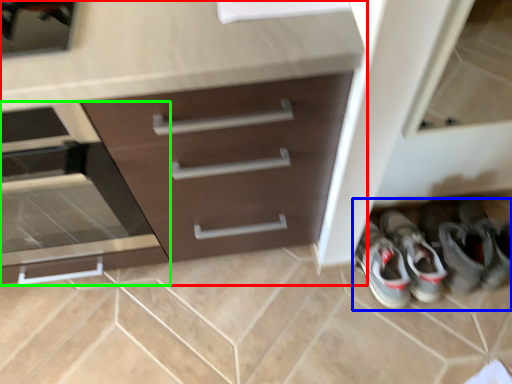
Question: Which object is positioned farthest from chest of drawers (highlighted by a red box)? Select from footwear (highlighted by a blue box) and drawer (highlighted by a green box).

Choices:
 (A) footwear
 (B) drawer

Answer: (A)